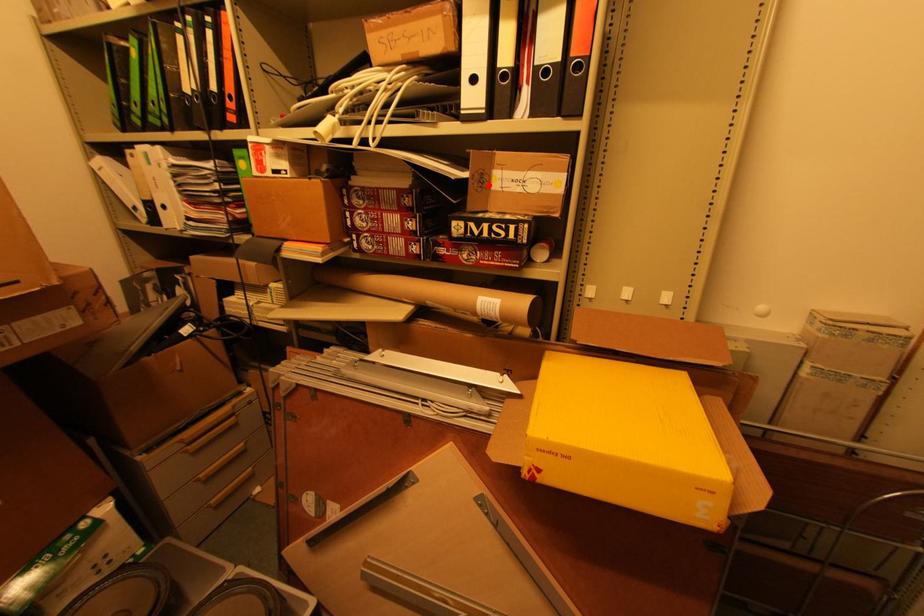
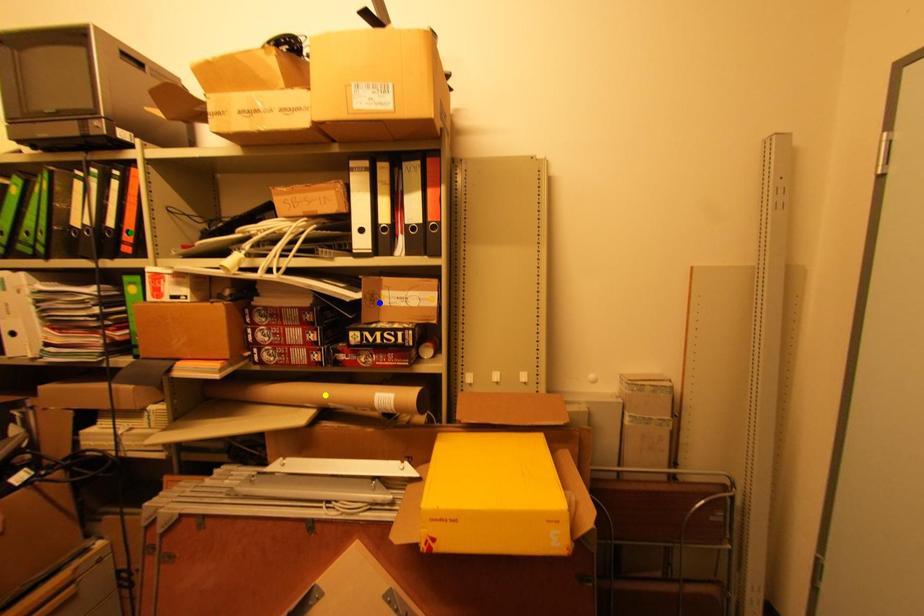
Question: I am providing you with two images of the same scene from different viewpoints. A red point is marked on the first image. You are given multiple points on the second image. Which point in image 2 represents the same 3d spot as the red point in image 1?

Choices:
 (A) blue point
 (B) yellow point
 (C) green point

Answer: (A)